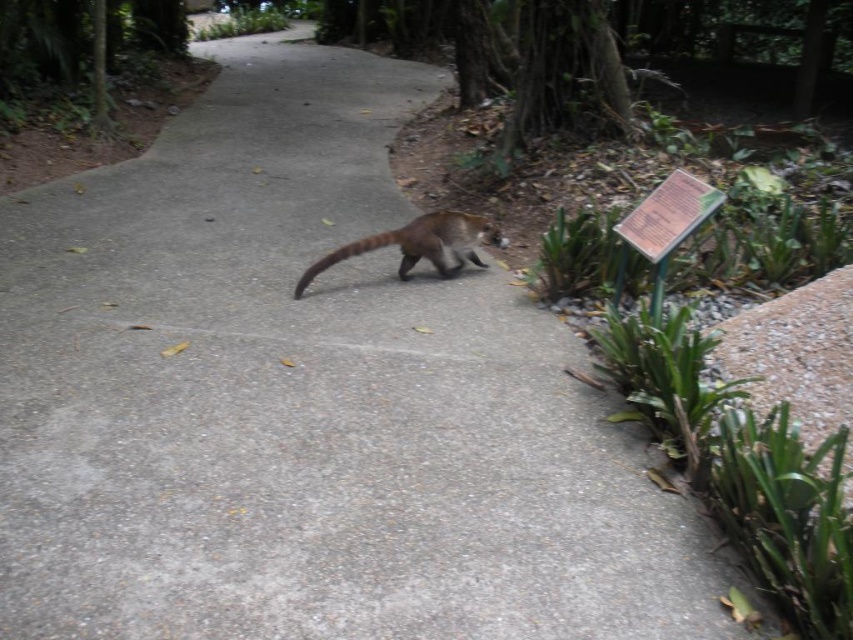
Does point (688, 228) come farther from viewer compared to point (300, 292)?

That is False.

Who is higher up, green plastic sign at right or brown fuzzy tail at center?

green plastic sign at right is above.

Between point (643, 209) and point (389, 234), which one is positioned behind?

Positioned behind is point (389, 234).

In order to click on green plastic sign at right in this screenshot , I will do `click(668, 214)`.